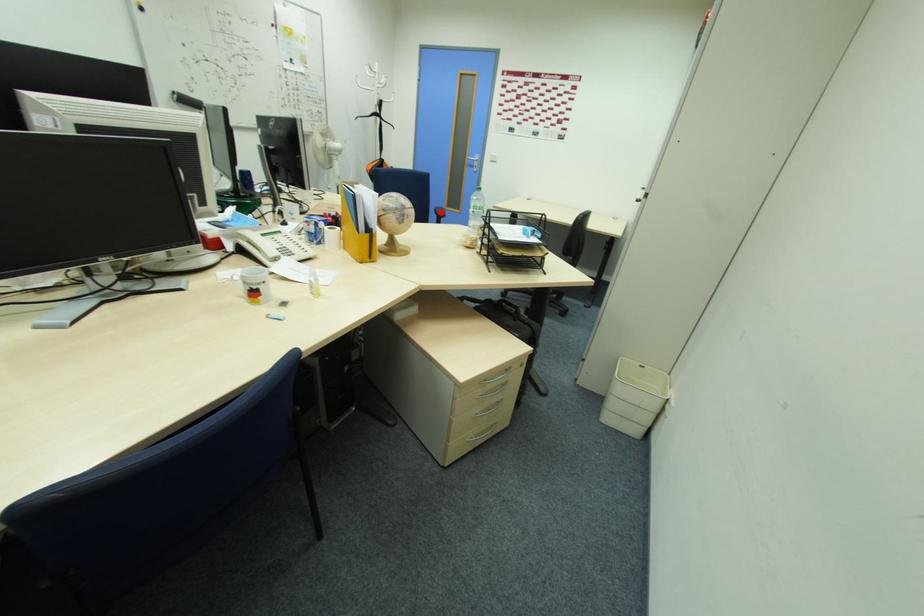
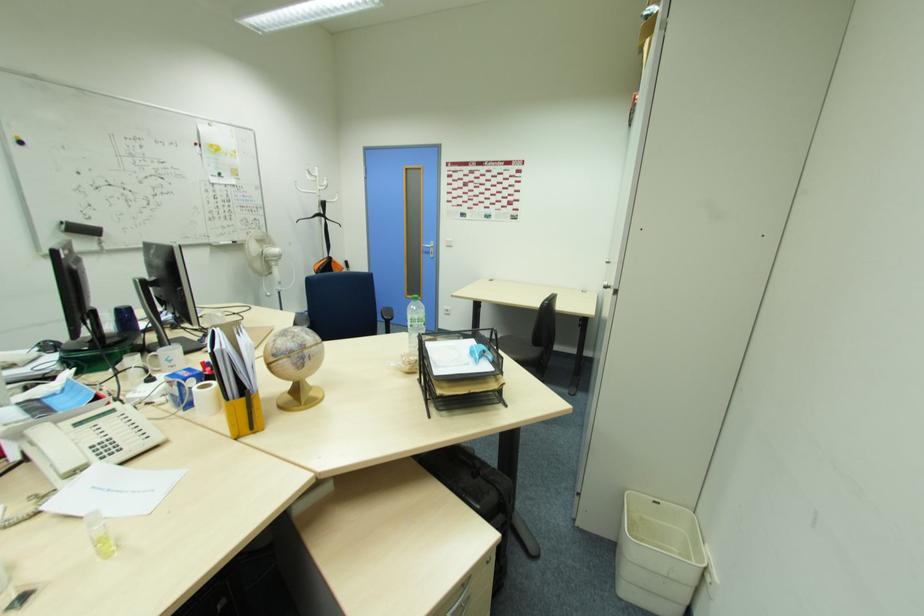
Where in the second image is the point corresponding to the highlighted location from the first image?

(386, 315)